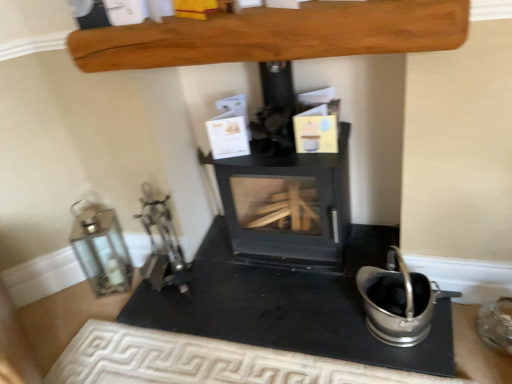
In order to click on free location to the left of transparent glass jar at lower right, the 1th appliance in the right-to-left sequence in this screenshot , I will do `click(468, 353)`.